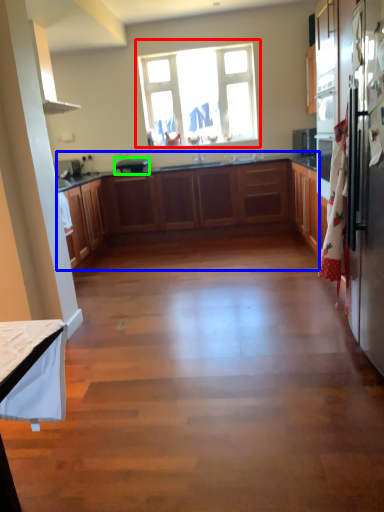
Question: Which object is positioned closest to window (highlighted by a red box)? Select from cabinetry (highlighted by a blue box) and appliance (highlighted by a green box).

Choices:
 (A) cabinetry
 (B) appliance

Answer: (B)